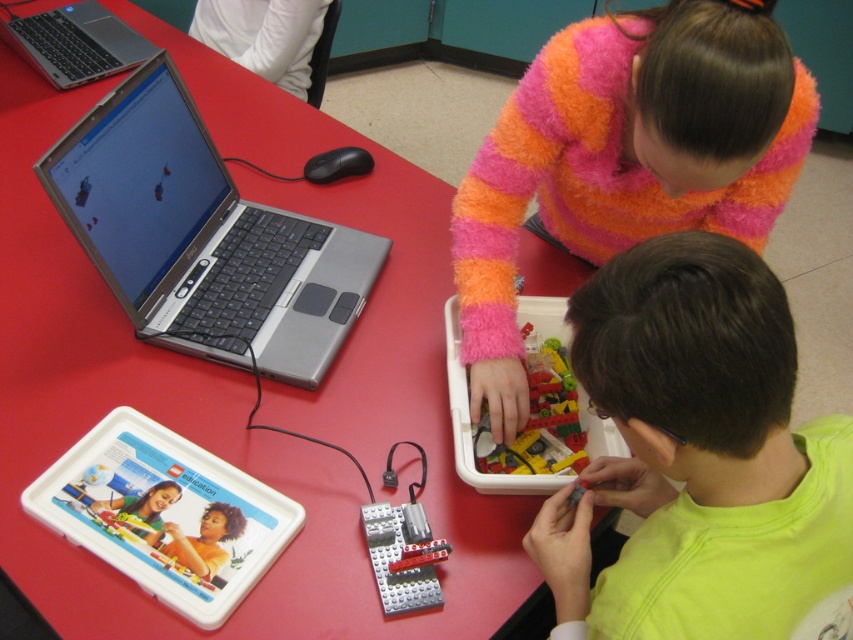
You are a teacher in the classroom. You need to place a new 12cm tall science kit on the table so that it doesn not block the laptop screen. Can the science kit be placed on the red plastic table at center without covering the silver metallic laptop at upper left?

The red plastic table at center has a greater height compared to the silver metallic laptop at upper left. Since the science kit is 12cm tall, it can be placed on the table without covering the laptop as the table is higher, allowing the kit to be positioned next to the laptop without obstruction.

You are a teacher in the classroom. You need to place a new box of books on the red plastic table at center so that it doesn not block the translucent plastic lego bricks at center. Considering their sizes, is this possible?

The red plastic table at center is much taller than the translucent plastic lego bricks at center, so placing the box of books on the table would not block the lego bricks since the table is elevated enough to keep the books above the bricks.